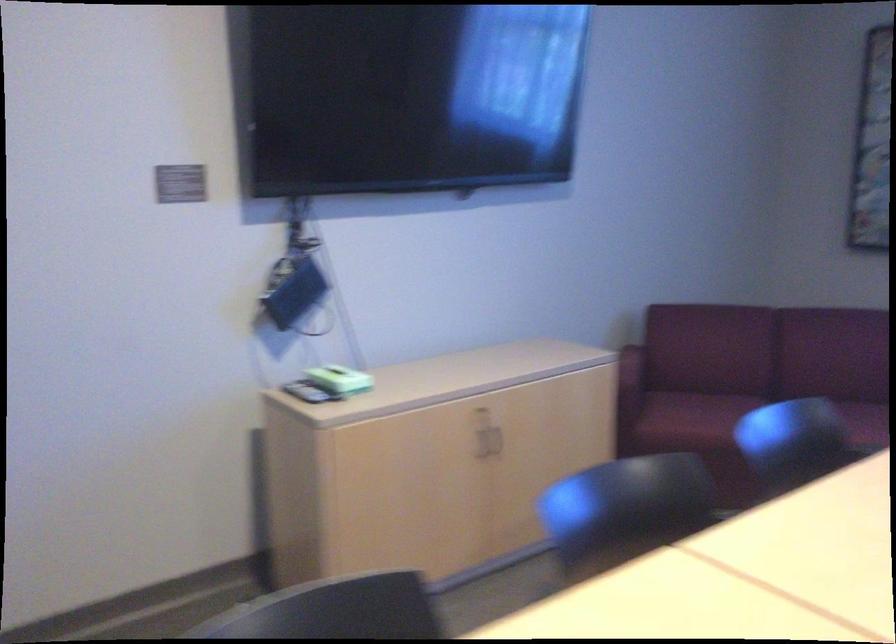
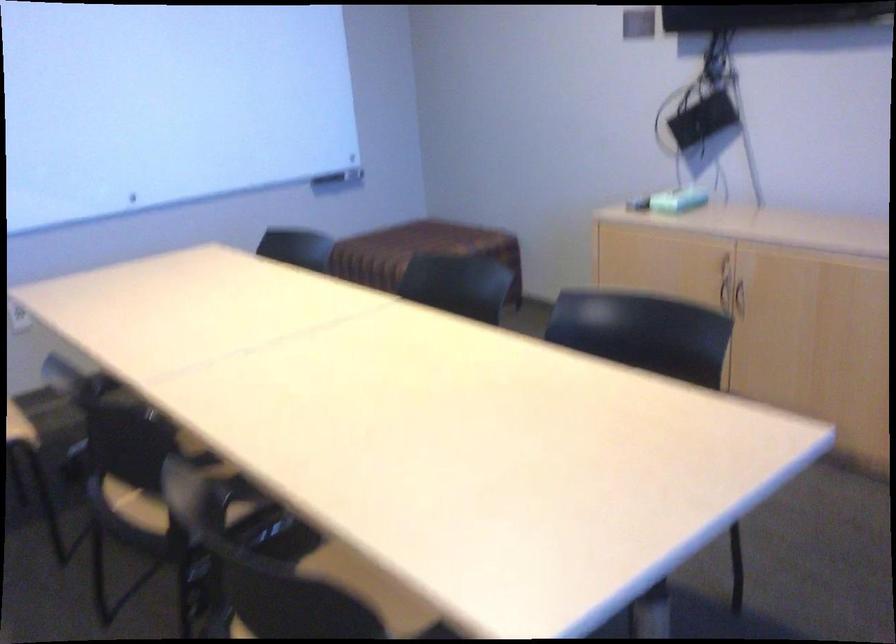
Where in the second image is the point corresponding to the point at 487,449 from the first image?

(738, 299)